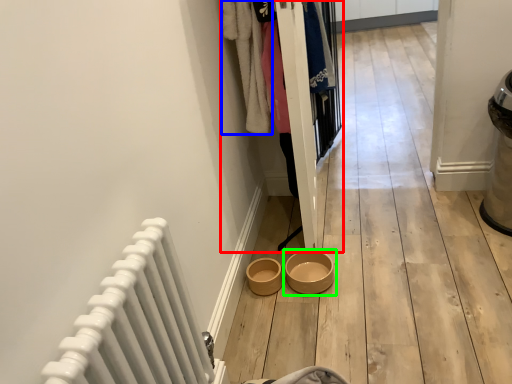
Question: Considering the real-world distances, which object is farthest from closet (highlighted by a red box)? clothing (highlighted by a blue box) or bowl (highlighted by a green box)?

Choices:
 (A) clothing
 (B) bowl

Answer: (B)